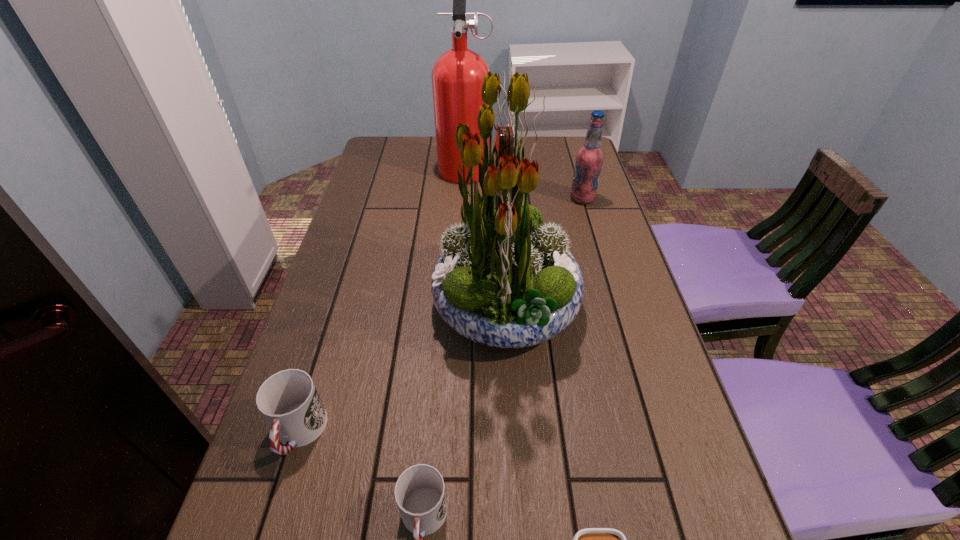
This screenshot has height=540, width=960. I want to click on free spot between the third shortest object and the rightmost object, so click(441, 316).

Find the location of a particular element. object that is the closest one to the third farthest object is located at coordinates (288, 400).

Locate which object is the fifth closest to the rightmost cup. Please provide its 2D coordinates. Your answer should be formatted as a tuple, i.e. [(x, y)], where the tuple contains the x and y coordinates of a point satisfying the conditions above.

[(457, 76)]

Where is `cup that stands as the second closest to the rightmost cup`? cup that stands as the second closest to the rightmost cup is located at coordinates (288, 400).

This screenshot has height=540, width=960. What are the coordinates of `cup object that ranks as the closest to the rightmost cup` in the screenshot? It's located at (420, 495).

Image resolution: width=960 pixels, height=540 pixels. In order to click on free space in the image that satisfies the following two spatial constraints: 1. on the front side of the alcohol; 2. on the right side of the fire extinguisher in this screenshot , I will do point(463,199).

This screenshot has height=540, width=960. I want to click on vacant point that satisfies the following two spatial constraints: 1. on the front side of the second farthest object; 2. on the front-facing side of the flower arrangement, so click(x=614, y=307).